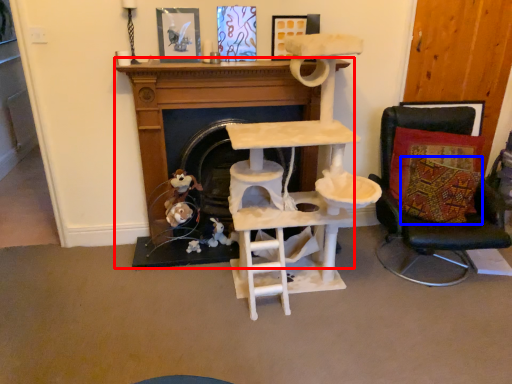
Question: Among these objects, which one is farthest to the camera, fireplace (highlighted by a red box) or pillow (highlighted by a blue box)?

Choices:
 (A) fireplace
 (B) pillow

Answer: (A)